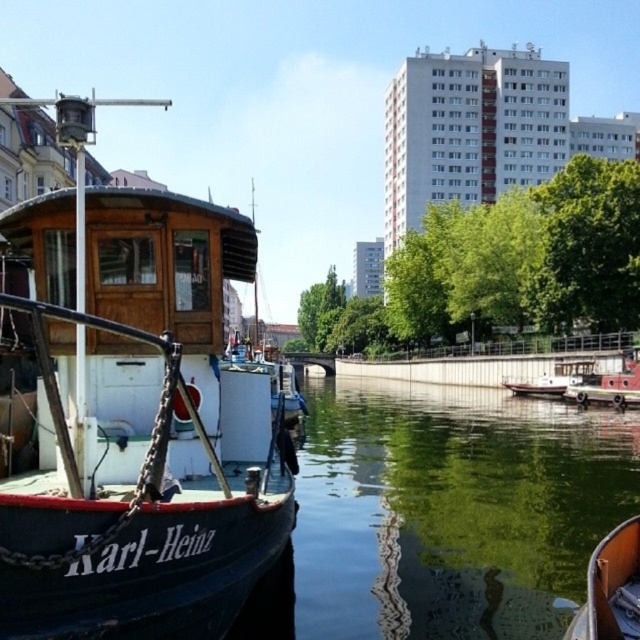
You are a delivery drone that needs to fly between the red metal boat at right and the white glossy boat at center. The minimum safe distance for your drone to pass between two objects is 4 meters. Can you safely navigate between them?

The red metal boat at right and the white glossy boat at center are 4.28 meters apart from each other. Since the minimum safe distance required is 4 meters, the drone can safely navigate between them as the distance is sufficient.